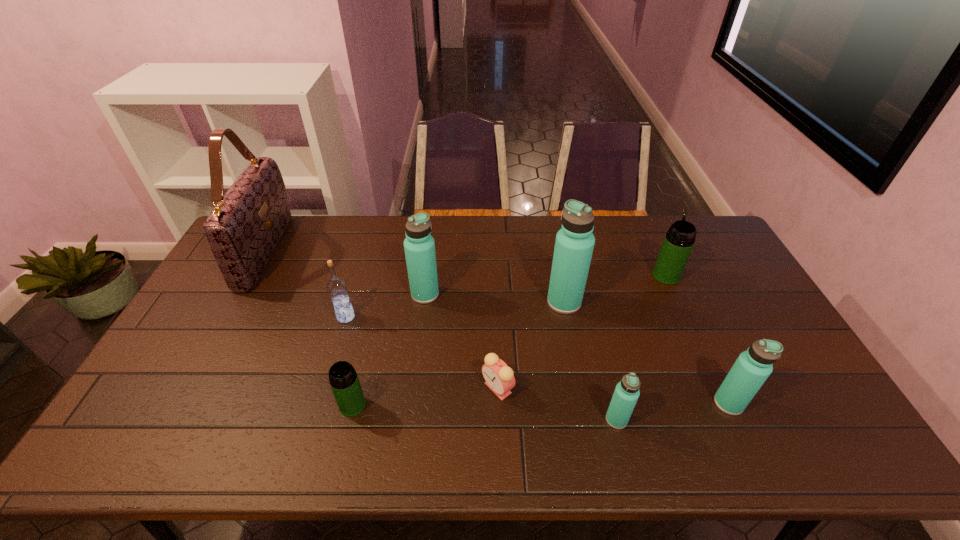
Find the location of `the leftmost object`. the leftmost object is located at coordinates (243, 229).

This screenshot has height=540, width=960. Identify the location of the tallest object. (243, 229).

Where is `the biggest aqua thermos bottle`? This screenshot has height=540, width=960. the biggest aqua thermos bottle is located at coordinates (574, 244).

Image resolution: width=960 pixels, height=540 pixels. I want to click on the tallest thermos bottle, so coord(574,244).

Image resolution: width=960 pixels, height=540 pixels. I want to click on the second tallest thermos bottle, so click(x=419, y=245).

Locate an element on the screen. the leftmost aqua thermos bottle is located at coordinates (419, 245).

I want to click on the bigger green thermos bottle, so click(x=679, y=240).

Locate an element on the screen. The width and height of the screenshot is (960, 540). the farther green thermos bottle is located at coordinates (679, 240).

At what (x,y) coordinates should I click in order to perform the action: click on the rightmost aqua thermos bottle. Please return your answer as a coordinate pair (x, y). This screenshot has height=540, width=960. Looking at the image, I should click on (751, 369).

The width and height of the screenshot is (960, 540). What are the coordinates of `vodka` in the screenshot? It's located at (337, 288).